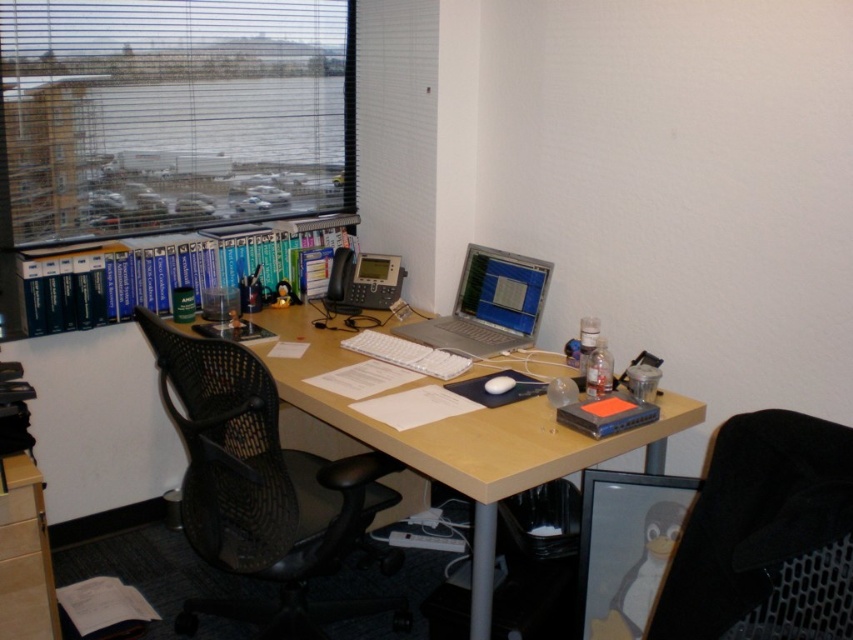
Question: Can you confirm if black mesh swivel chair at center is positioned below silver metallic laptop at center?

Choices:
 (A) no
 (B) yes

Answer: (B)

Question: In this image, where is wooden desk at center located relative to blue hardcover books at upper left?

Choices:
 (A) below
 (B) above

Answer: (A)

Question: Which point appears farthest from the camera in this image?

Choices:
 (A) (437, 316)
 (B) (279, 65)
 (C) (310, 388)

Answer: (B)

Question: Is transparent plastic blinds at upper left to the left of silver metallic laptop at center from the viewer's perspective?

Choices:
 (A) yes
 (B) no

Answer: (A)

Question: Which point is closer to the camera?

Choices:
 (A) (18, 310)
 (B) (230, 483)
 (C) (521, 369)
 (D) (776, 456)

Answer: (D)

Question: Which object is farther from the camera taking this photo?

Choices:
 (A) wooden desk at center
 (B) black mesh swivel chair at lower right
 (C) silver metallic laptop at center
 (D) black mesh swivel chair at center

Answer: (C)